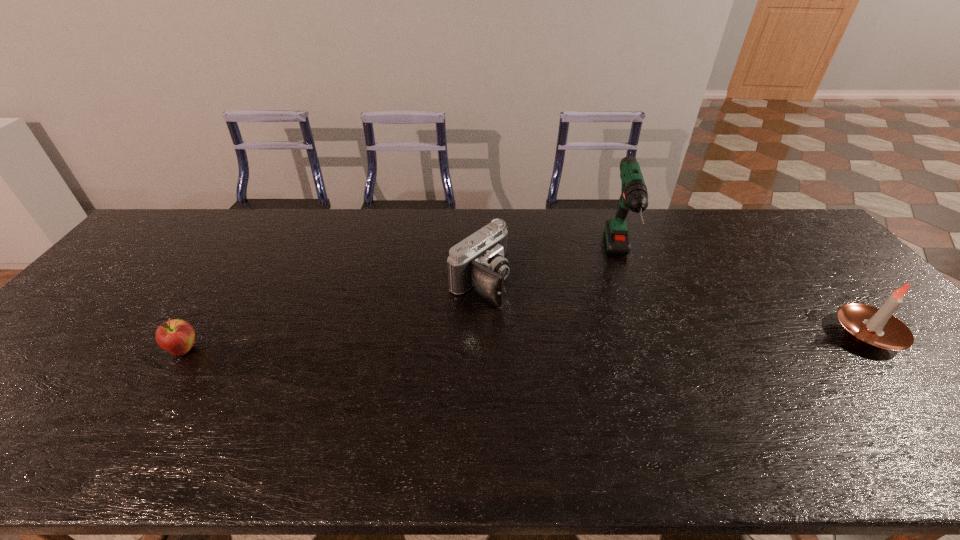
Where is `free spot located 0.290m at the front of the camera with an open lens cover`? This screenshot has height=540, width=960. free spot located 0.290m at the front of the camera with an open lens cover is located at coordinates (591, 354).

Identify the location of vacant region located at the front of the camera with an open lens cover. (602, 361).

Where is `free space located 0.240m on the handle side of the drill`? The image size is (960, 540). free space located 0.240m on the handle side of the drill is located at coordinates (644, 362).

Find the location of a particular element. The image size is (960, 540). free location located 0.310m on the handle side of the drill is located at coordinates (648, 386).

The width and height of the screenshot is (960, 540). Find the location of `vacant region located on the handle side of the drill`. vacant region located on the handle side of the drill is located at coordinates (642, 350).

Where is `object located in the far edge section of the desktop`? The width and height of the screenshot is (960, 540). object located in the far edge section of the desktop is located at coordinates (634, 196).

What are the coordinates of `object that is at the right edge` in the screenshot? It's located at (876, 328).

This screenshot has width=960, height=540. I want to click on free space at the far edge of the desktop, so click(x=593, y=217).

This screenshot has width=960, height=540. In order to click on vacant position at the near edge of the desktop in this screenshot , I will do `click(420, 404)`.

In the image, there is a desktop. Identify the location of free space at the right edge. This screenshot has height=540, width=960. (826, 304).